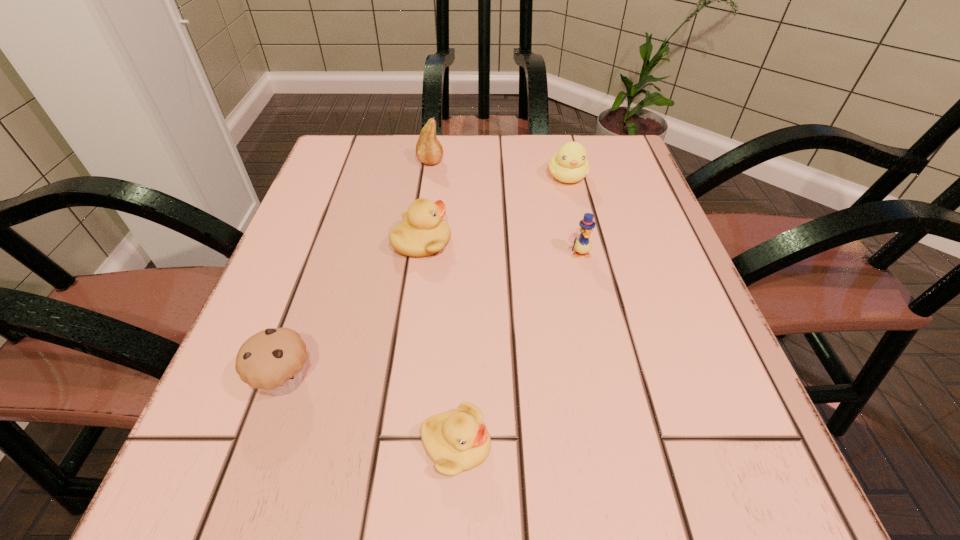
Locate an element on the screen. vacant space at the near left corner of the desktop is located at coordinates (201, 520).

Where is `free space between the nearest duckling and the pear`? free space between the nearest duckling and the pear is located at coordinates (444, 303).

Where is `vacant region between the fifth farthest object and the farthest duckling`? This screenshot has width=960, height=540. vacant region between the fifth farthest object and the farthest duckling is located at coordinates (426, 279).

Locate an element on the screen. vacant area that lies between the pear and the farthest duckling is located at coordinates (499, 170).

Image resolution: width=960 pixels, height=540 pixels. I want to click on empty space that is in between the shortest object and the farthest duckling, so click(512, 311).

In order to click on free point between the farthest duckling and the tallest object in this screenshot , I will do `click(499, 170)`.

The image size is (960, 540). Find the location of `object that stands as the fourth closest to the tallest object`. object that stands as the fourth closest to the tallest object is located at coordinates (273, 360).

Identify which object is located as the third nearest to the nearest object. Please provide its 2D coordinates. Your answer should be formatted as a tuple, i.e. [(x, y)], where the tuple contains the x and y coordinates of a point satisfying the conditions above.

[(583, 245)]

Find the location of a particular element. duckling that is the closest to the farthest duckling is located at coordinates (583, 245).

Find the location of a particular element. the third closest duckling to the shortest duckling is located at coordinates (570, 164).